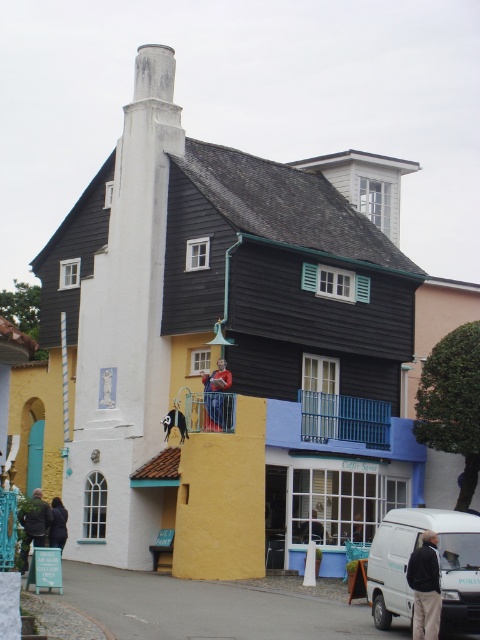
You are standing in front of the whimsical building and notice the blue metal railing at center. Can you determine its exact position relative to the building?

The blue metal railing at center is located at point coordinates 0.655 on the x and 0.719 on the y axis.

You are an interior designer planning to place a rectangular table between the black leather jacket at lower left and the dark blue fabric at center. The table must fit snugly between them without exceeding the space. Given that the table requires a minimum width of 1.2 meters to accommodate seating, can the space between these two objects accommodate the table?

The black leather jacket at lower left is wider than the dark blue fabric at center. Since the table requires a minimum width of 1.2 meters, the space between them may be sufficient if the difference in width between the two objects meets or exceeds this requirement. However, without exact measurements, it is difficult to confirm definitively.